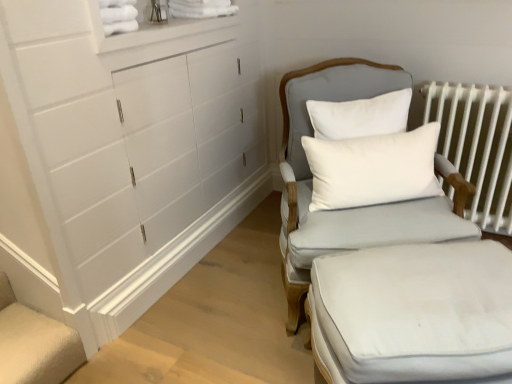
Question: Does point (343, 370) appear closer or farther from the camera than point (390, 220)?

Choices:
 (A) farther
 (B) closer

Answer: (B)

Question: Which is correct: white fabric ottoman at lower right is inside light gray fabric chair at center-right, or outside of it?

Choices:
 (A) inside
 (B) outside

Answer: (B)

Question: Based on their relative distances, which object is nearer to the white cotton pillow at center?

Choices:
 (A) white metal radiator at right
 (B) white fabric ottoman at lower right
 (C) light gray fabric chair at center-right

Answer: (C)

Question: Which is nearer to the light gray fabric chair at center-right?

Choices:
 (A) white cotton pillow at center
 (B) white metal radiator at right
 (C) white fabric ottoman at lower right

Answer: (A)